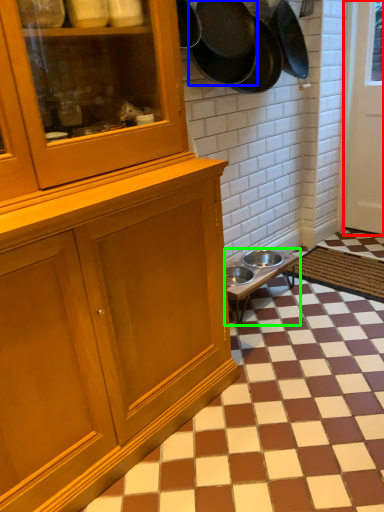
Question: Considering the real-world distances, which object is closest to door (highlighted by a red box)? frying pan (highlighted by a blue box) or table (highlighted by a green box).

Choices:
 (A) frying pan
 (B) table

Answer: (B)